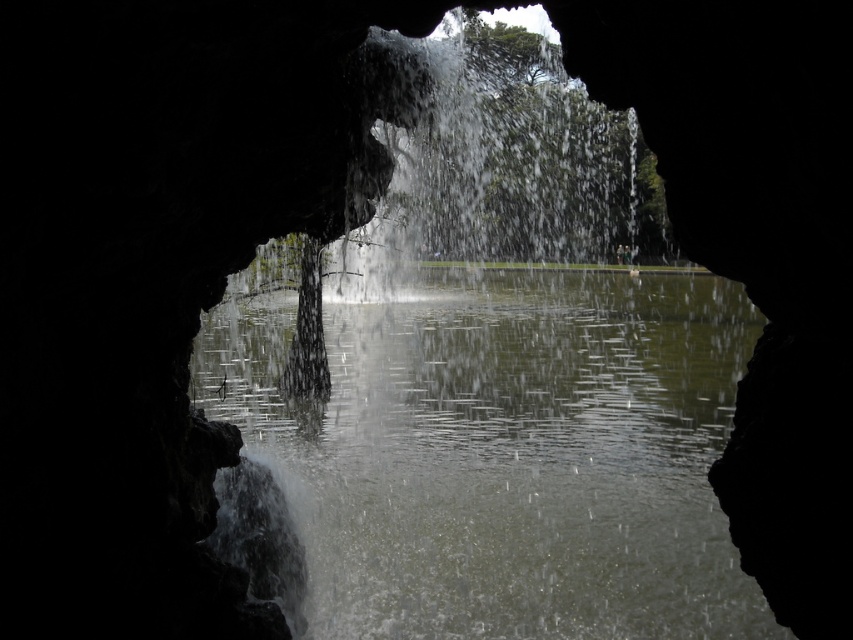
Does clear water at center have a lesser width compared to white frothy water at center?

Incorrect, clear water at center's width is not less than white frothy water at center's.

Is clear water at center taller than white frothy water at center?

Indeed, clear water at center has a greater height compared to white frothy water at center.

Locate an element on the screen. The image size is (853, 640). clear water at center is located at coordinates (503, 452).

Locate an element on the screen. The height and width of the screenshot is (640, 853). clear water at center is located at coordinates (503, 452).